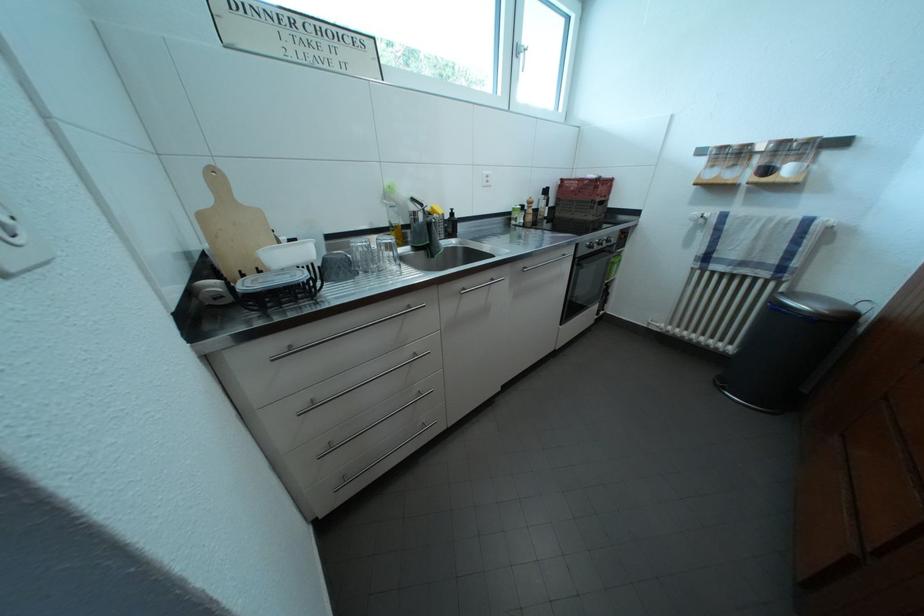
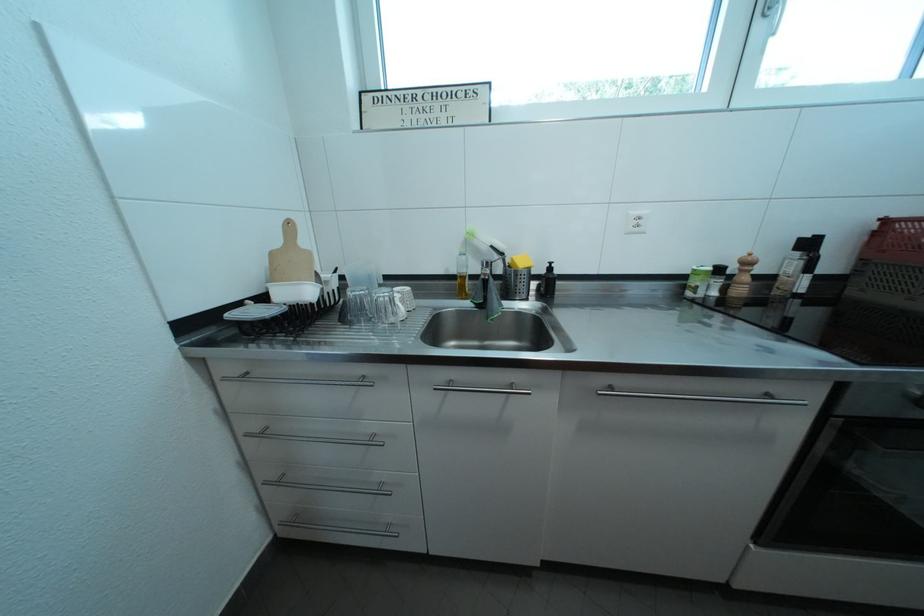
Question: The camera is either moving clockwise (left) or counter-clockwise (right) around the object. The first image is from the beginning of the video and the second image is from the end. Is the camera moving left or right when shooting the video?

Choices:
 (A) Left
 (B) Right

Answer: (B)